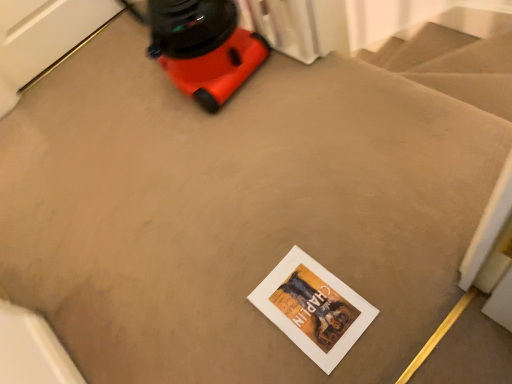
Question: Are orange plastic vacuum cleaner at upper left and white matte postcard at center far apart?

Choices:
 (A) yes
 (B) no

Answer: (B)

Question: Is orange plastic vacuum cleaner at upper left surrounding white matte postcard at center?

Choices:
 (A) yes
 (B) no

Answer: (B)

Question: From the image's perspective, is orange plastic vacuum cleaner at upper left above white matte postcard at center?

Choices:
 (A) yes
 (B) no

Answer: (A)

Question: Is orange plastic vacuum cleaner at upper left thinner than white matte postcard at center?

Choices:
 (A) yes
 (B) no

Answer: (B)

Question: Considering the relative positions of orange plastic vacuum cleaner at upper left and white matte postcard at center in the image provided, is orange plastic vacuum cleaner at upper left in front of white matte postcard at center?

Choices:
 (A) no
 (B) yes

Answer: (A)

Question: Could you tell me if orange plastic vacuum cleaner at upper left is facing white matte postcard at center?

Choices:
 (A) no
 (B) yes

Answer: (A)

Question: Can orange plastic vacuum cleaner at upper left be found inside white matte postcard at center?

Choices:
 (A) yes
 (B) no

Answer: (B)

Question: From a real-world perspective, is white matte postcard at center physically below orange plastic vacuum cleaner at upper left?

Choices:
 (A) no
 (B) yes

Answer: (B)

Question: Is white matte postcard at center placed right next to orange plastic vacuum cleaner at upper left?

Choices:
 (A) yes
 (B) no

Answer: (B)

Question: Is white matte postcard at center to the left of orange plastic vacuum cleaner at upper left from the viewer's perspective?

Choices:
 (A) yes
 (B) no

Answer: (B)

Question: Is white matte postcard at center further to camera compared to orange plastic vacuum cleaner at upper left?

Choices:
 (A) no
 (B) yes

Answer: (A)

Question: Would you consider white matte postcard at center to be distant from orange plastic vacuum cleaner at upper left?

Choices:
 (A) no
 (B) yes

Answer: (A)

Question: From a real-world perspective, is orange plastic vacuum cleaner at upper left above or below white matte postcard at center?

Choices:
 (A) below
 (B) above

Answer: (B)